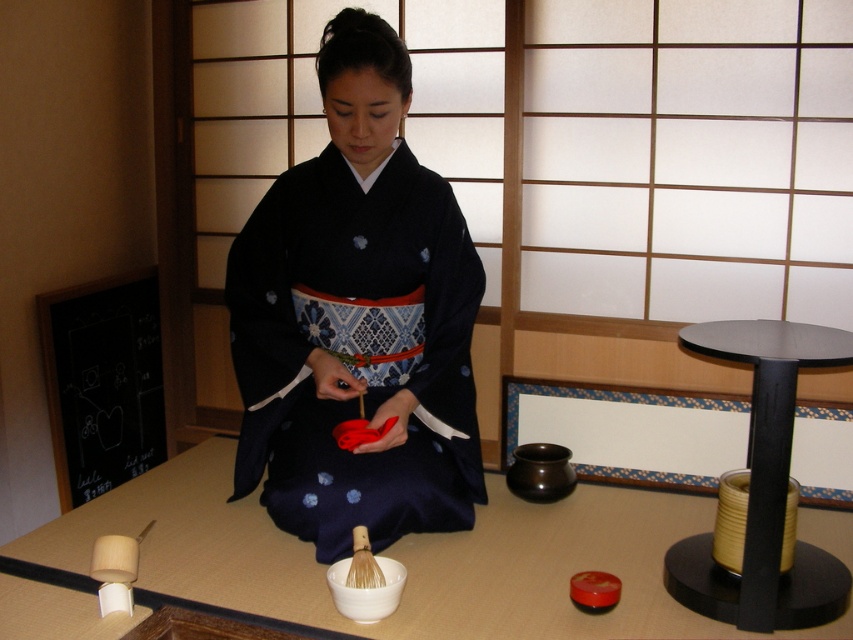
Is matte black kimono at center smaller than smooth wooden table at center?

Correct, matte black kimono at center occupies less space than smooth wooden table at center.

Is the position of matte black kimono at center more distant than that of smooth wooden table at center?

That is True.

I want to click on matte black kimono at center, so click(x=357, y=320).

Is point (415, 417) farther from camera compared to point (788, 593)?

Yes, point (415, 417) is farther from viewer.

Looking at this image, between matte black kimono at center and black matte table at right, which one has more height?

Standing taller between the two is matte black kimono at center.

From the picture: Who is more distant from viewer, (378, 125) or (752, 387)?

Positioned behind is point (752, 387).

Find the location of a particular element. matte black kimono at center is located at coordinates (357, 320).

Which is more to the left, smooth wooden table at center or black matte table at right?

smooth wooden table at center

Is smooth wooden table at center to the right of black matte table at right from the viewer's perspective?

No, smooth wooden table at center is not to the right of black matte table at right.

Does point (314, 600) come closer to viewer compared to point (706, 541)?

Yes, point (314, 600) is closer to viewer.

Locate an element on the screen. The height and width of the screenshot is (640, 853). smooth wooden table at center is located at coordinates 403,557.